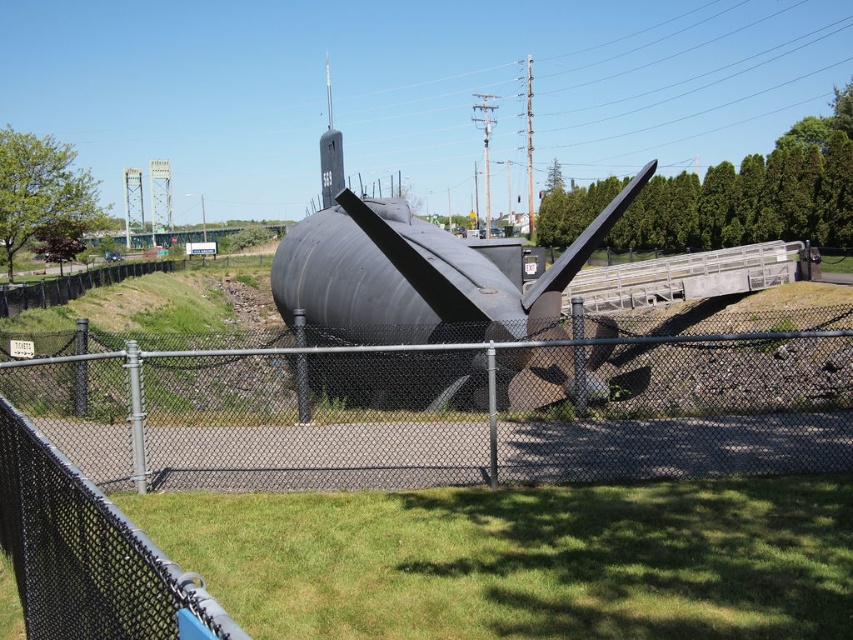
Does gray chain-link fence at center appear under matte black submarine at center?

Yes, gray chain-link fence at center is below matte black submarine at center.

What do you see at coordinates (442, 416) in the screenshot? I see `gray chain-link fence at center` at bounding box center [442, 416].

Consider the image. Who is more forward, (405, 387) or (434, 289)?

Point (405, 387) is more forward.

The width and height of the screenshot is (853, 640). Find the location of `gray chain-link fence at center`. gray chain-link fence at center is located at coordinates (442, 416).

Is point (606, 419) less distant than point (453, 502)?

No, it is behind (453, 502).

Identify the location of gray chain-link fence at center. Image resolution: width=853 pixels, height=640 pixels. (442, 416).

Image resolution: width=853 pixels, height=640 pixels. Identify the location of gray chain-link fence at center. (442, 416).

Which is more to the right, green grass at lower center or matte black submarine at center?

green grass at lower center

Is point (730, 627) in front of point (387, 224)?

That is True.

The height and width of the screenshot is (640, 853). What do you see at coordinates (524, 560) in the screenshot? I see `green grass at lower center` at bounding box center [524, 560].

This screenshot has width=853, height=640. I want to click on green grass at lower center, so click(x=524, y=560).